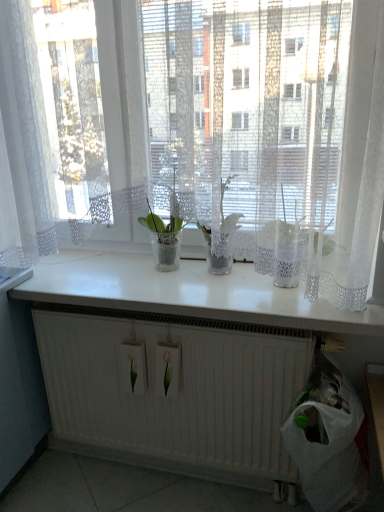
Find the location of a particular element. Image resolution: width=384 pixels, height=512 pixels. vacant space underneath white lace curtain at upper center (from a real-world perspective) is located at coordinates (160, 295).